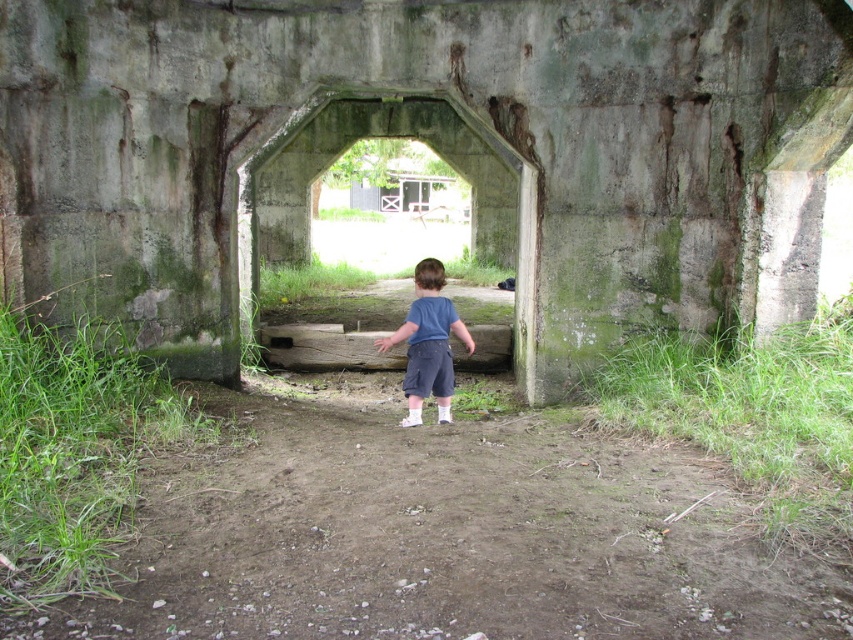
Question: Which of the following is the farthest from the observer?

Choices:
 (A) green concrete tunnel at center
 (B) dirt ground at center
 (C) blue cotton shirt at center

Answer: (A)

Question: Which object appears farthest from the camera in this image?

Choices:
 (A) green concrete tunnel at center
 (B) blue cotton shirt at center
 (C) dirt ground at center

Answer: (A)

Question: Can you confirm if dirt ground at center is smaller than green concrete tunnel at center?

Choices:
 (A) yes
 (B) no

Answer: (A)

Question: Is dirt ground at center wider than blue cotton shirt at center?

Choices:
 (A) yes
 (B) no

Answer: (A)

Question: Which object is the closest to the blue cotton shirt at center?

Choices:
 (A) dirt ground at center
 (B) green concrete tunnel at center

Answer: (A)

Question: Can you confirm if dirt ground at center is wider than green concrete tunnel at center?

Choices:
 (A) yes
 (B) no

Answer: (B)